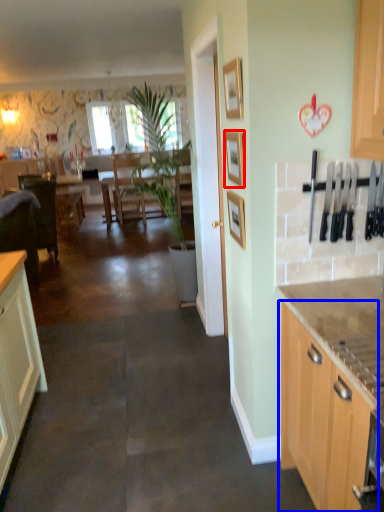
Question: Which object appears farthest to the camera in this image, picture frame (highlighted by a red box) or cabinetry (highlighted by a blue box)?

Choices:
 (A) picture frame
 (B) cabinetry

Answer: (A)